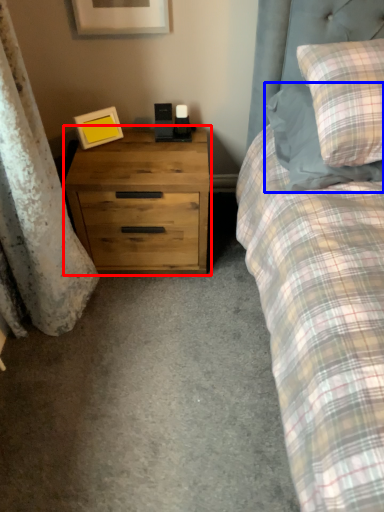
Question: Among these objects, which one is nearest to the camera, chest of drawers (highlighted by a red box) or pillow (highlighted by a blue box)?

Choices:
 (A) chest of drawers
 (B) pillow

Answer: (B)